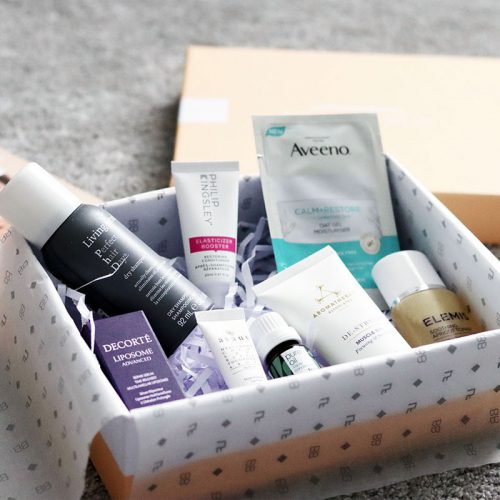
Identify the location of small bottle with white cap containing  oil of some type. Image resolution: width=500 pixels, height=500 pixels. (284, 353).